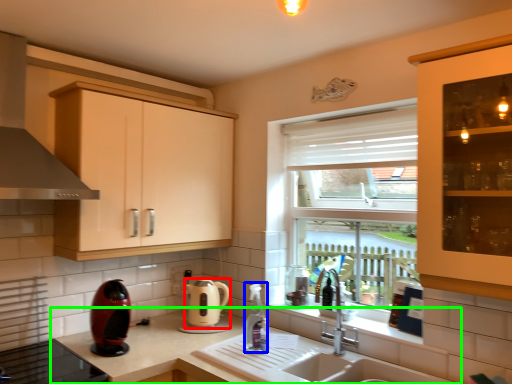
Question: Which object is the farthest from kitchen appliance (highlighted by a red box)? Choose among these: bottle (highlighted by a blue box) or countertop (highlighted by a green box).

Choices:
 (A) bottle
 (B) countertop

Answer: (A)